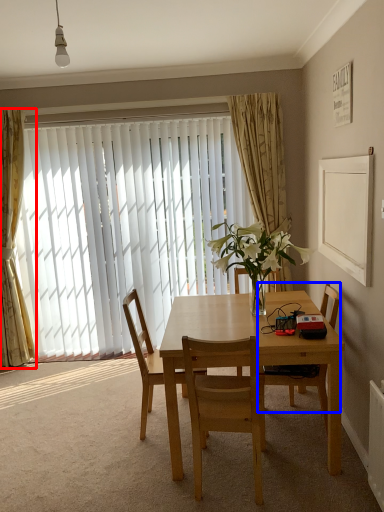
Question: Which of the following is the farthest to the observer, curtain (highlighted by a red box) or chair (highlighted by a blue box)?

Choices:
 (A) curtain
 (B) chair

Answer: (A)